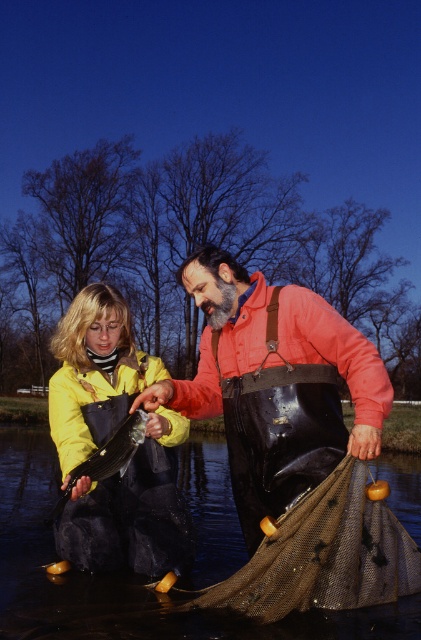
Question: Does rubber waders at center come behind yellow matte jacket at center?

Choices:
 (A) no
 (B) yes

Answer: (A)

Question: Which point is closer to the camera?

Choices:
 (A) (66, 502)
 (B) (287, 637)
 (C) (314, 364)

Answer: (B)

Question: Does brown mesh net at lower center come in front of shiny silver fish at center?

Choices:
 (A) no
 (B) yes

Answer: (B)

Question: Among these objects, which one is nearest to the camera?

Choices:
 (A) brown mesh net at lower center
 (B) rubber waders at center
 (C) shiny silver fish at center

Answer: (B)

Question: Which object is closer to the camera taking this photo?

Choices:
 (A) black rubber boots at lower center
 (B) yellow matte jacket at center
 (C) rubber waders at center

Answer: (A)

Question: Does yellow matte jacket at center have a larger size compared to shiny silver fish at center?

Choices:
 (A) yes
 (B) no

Answer: (A)